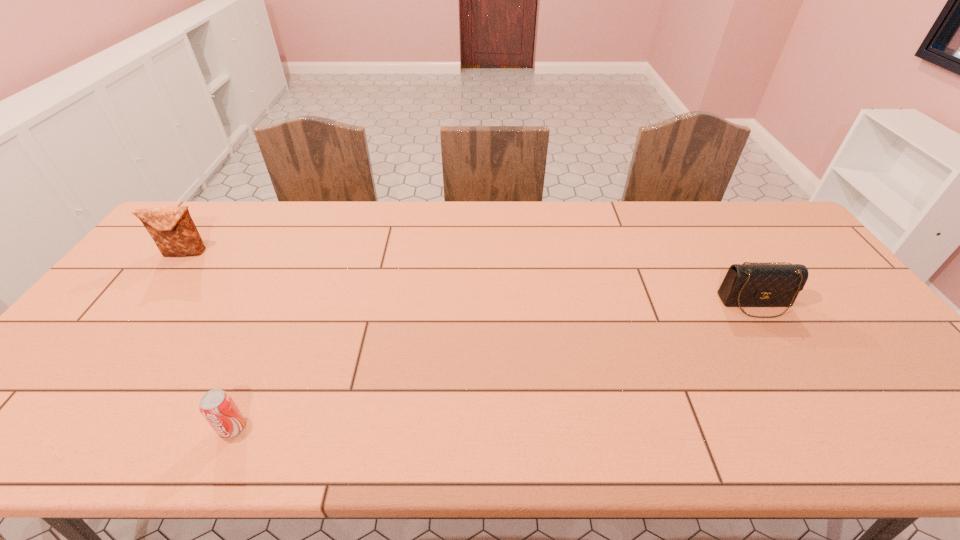
In order to click on the farther clutch bag in this screenshot , I will do `click(172, 229)`.

Where is `the tallest object`? Image resolution: width=960 pixels, height=540 pixels. the tallest object is located at coordinates [172, 229].

Where is `the rightmost object`? The image size is (960, 540). the rightmost object is located at coordinates (752, 284).

Locate an element on the screen. The image size is (960, 540). the nearer clutch bag is located at coordinates (752, 284).

Locate an element on the screen. the second object from right to left is located at coordinates (217, 407).

This screenshot has width=960, height=540. I want to click on the nearest object, so click(x=217, y=407).

Where is `vacant space located on the open side of the farther clutch bag`? This screenshot has height=540, width=960. vacant space located on the open side of the farther clutch bag is located at coordinates (146, 305).

Locate an element on the screen. vacant point located 0.080m on the front flap of the second nearest object is located at coordinates (780, 342).

Identify the location of object located at the near edge. (217, 407).

I want to click on object that is positioned at the left edge, so click(172, 229).